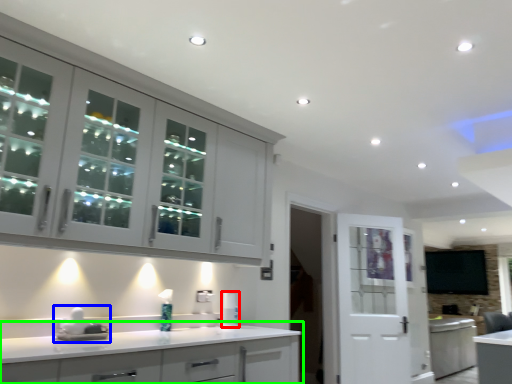
Question: Which is nearer to the appliance (highlighted by a red box)? sink (highlighted by a blue box) or cabinetry (highlighted by a green box).

Choices:
 (A) sink
 (B) cabinetry

Answer: (B)